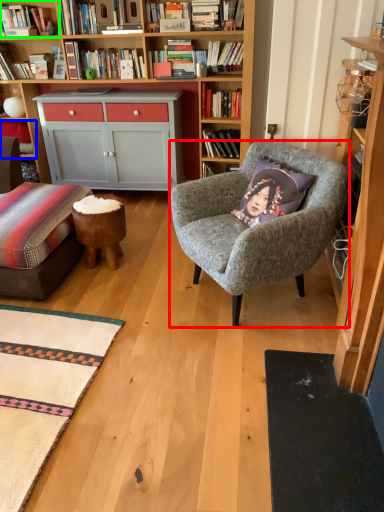
Question: Which object is the closest to the chair (highlighted by a red box)? Choose among these: shelf (highlighted by a blue box) or shelf (highlighted by a green box).

Choices:
 (A) shelf
 (B) shelf

Answer: (B)